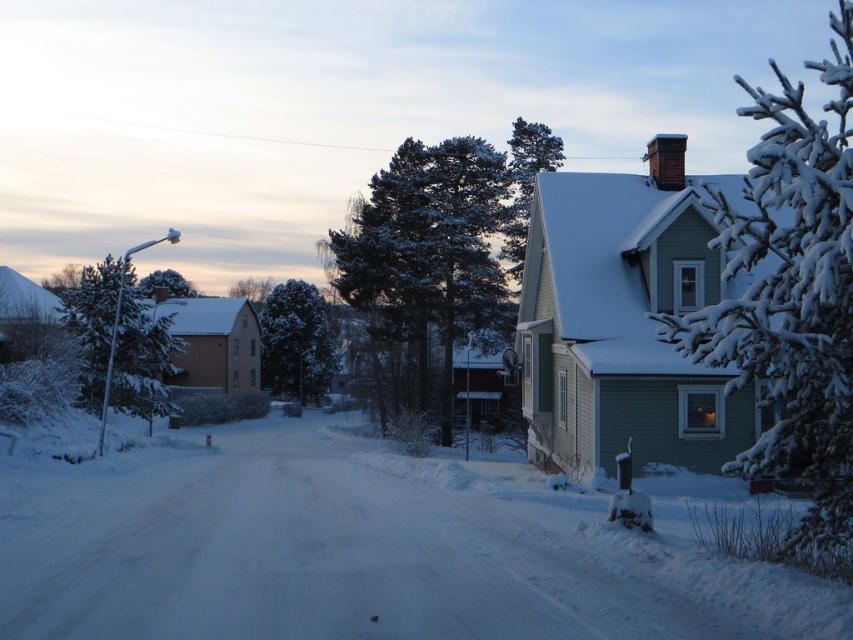
Measure the distance between point (318, 369) and camera.

Point (318, 369) and camera are 285.75 feet apart.

Between green textured tree at center and green matte tree at center, which one appears on the left side from the viewer's perspective?

green matte tree at center is more to the left.

Image resolution: width=853 pixels, height=640 pixels. I want to click on green textured tree at center, so click(x=296, y=342).

Who is more forward, (158, 272) or (236, 285)?

Point (158, 272) is more forward.

Can you confirm if green textured tree at upper left is bigger than green matte tree at center?

Indeed, green textured tree at upper left has a larger size compared to green matte tree at center.

Is point (154, 275) behind point (247, 276)?

No, it is not.

The height and width of the screenshot is (640, 853). Identify the location of green textured tree at upper left. (165, 284).

Does white fluffy snow at center lie behind snow-covered branches at upper right?

That is False.

Which is more to the left, white fluffy snow at center or snow-covered branches at upper right?

white fluffy snow at center is more to the left.

Who is more forward, (729, 600) or (830, 301)?

Positioned in front is point (830, 301).

Where is `white fluffy snow at center`? This screenshot has width=853, height=640. white fluffy snow at center is located at coordinates (363, 550).